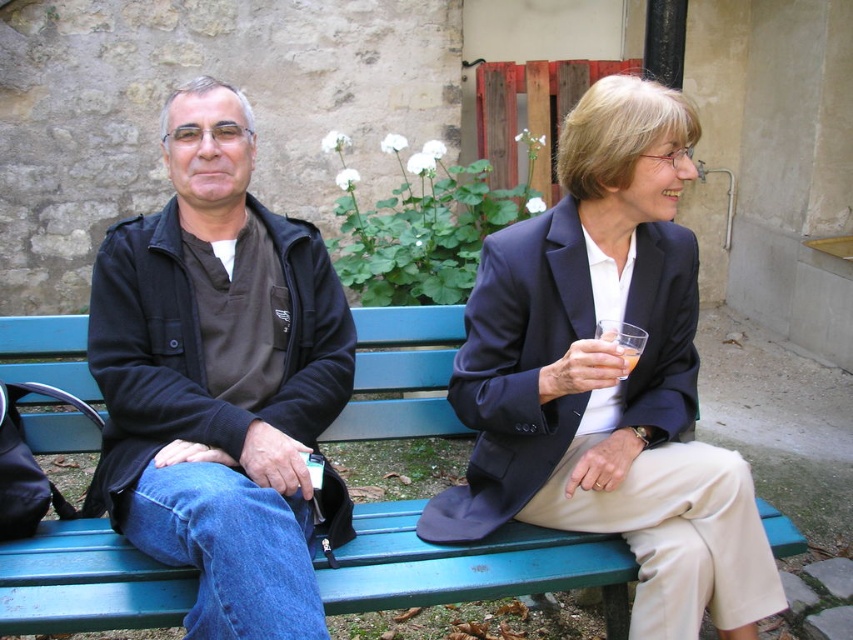
Which is more to the right, matte black blazer at center or dark blue jacket at left?

Positioned to the right is matte black blazer at center.

Which is in front, point (679, 572) or point (264, 224)?

Point (679, 572) is in front.

You are a GUI agent. You are given a task and a screenshot of the screen. Output one action in this format:
    pyautogui.click(x=<x>, y=<y>)
    Task: Click on the matte black blazer at center
    
    Given the screenshot: What is the action you would take?
    pyautogui.click(x=607, y=378)

Based on the photo, can you confirm if dark blue jacket at left is bigger than green painted wood bench at center?

Indeed, dark blue jacket at left has a larger size compared to green painted wood bench at center.

Which is below, dark blue jacket at left or green painted wood bench at center?

green painted wood bench at center is lower down.

Does point (122, 516) lie in front of point (106, 618)?

No.

At what (x,y) coordinates should I click in order to perform the action: click on dark blue jacket at left. Please return your answer as a coordinate pair (x, y). The height and width of the screenshot is (640, 853). Looking at the image, I should click on (x=218, y=378).

Does matte black blazer at center appear under green painted wood bench at center?

Actually, matte black blazer at center is above green painted wood bench at center.

Does matte black blazer at center appear on the right side of green painted wood bench at center?

Indeed, matte black blazer at center is positioned on the right side of green painted wood bench at center.

Is point (608, 355) positioned behind point (486, 552)?

No, (608, 355) is closer to viewer.

The width and height of the screenshot is (853, 640). Find the location of `matte black blazer at center`. matte black blazer at center is located at coordinates (607, 378).